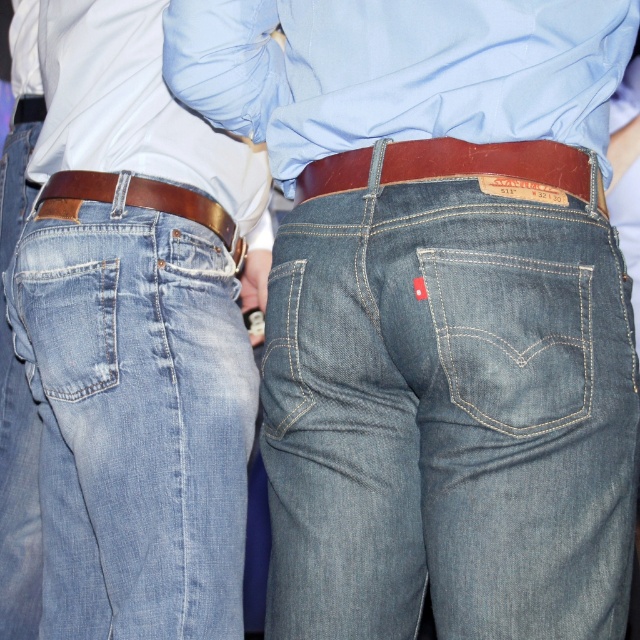
What do you see at coordinates (397, 72) in the screenshot? This screenshot has height=640, width=640. I see `light blue cotton dress shirt at center` at bounding box center [397, 72].

Is the position of light blue cotton dress shirt at center less distant than that of white cotton dress shirt at upper center?

Yes, light blue cotton dress shirt at center is closer to the viewer.

What are the coordinates of `light blue cotton dress shirt at center` in the screenshot? It's located at (397, 72).

Is denim at center thinner than white cotton dress shirt at upper center?

Indeed, denim at center has a lesser width compared to white cotton dress shirt at upper center.

Is point (284, 403) positioned in front of point (77, 136)?

Yes, point (284, 403) is closer to viewer.

What are the coordinates of `denim at center` in the screenshot? It's located at (449, 416).

Is point (125, 56) closer to camera compared to point (3, 358)?

Yes, it is.

Is white cotton dress shirt at upper center bigger than light blue denim jeans at left?

Yes, white cotton dress shirt at upper center is bigger than light blue denim jeans at left.

Who is more forward, (109,108) or (20,192)?

Point (109,108) is in front.

Find the location of a particular element. white cotton dress shirt at upper center is located at coordinates (125, 106).